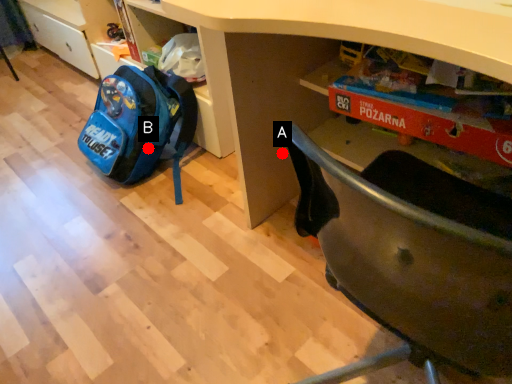
Question: Two points are circled on the image, labeled by A and B beside each circle. Which of the following is the farthest from the observer?

Choices:
 (A) A is further
 (B) B is further

Answer: (B)